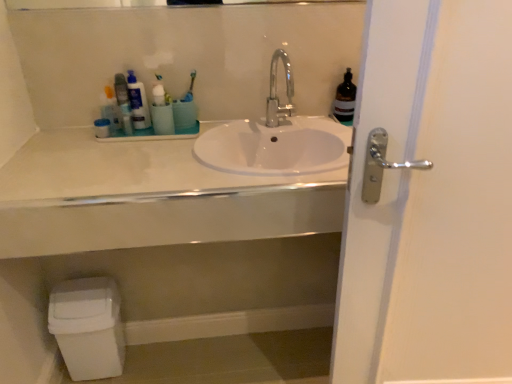
Find the location of `matte plastic container at upper left, placed as the first toiletry when sorted from left to right`. matte plastic container at upper left, placed as the first toiletry when sorted from left to right is located at coordinates tap(110, 111).

The height and width of the screenshot is (384, 512). What do you see at coordinates (102, 128) in the screenshot?
I see `white plastic container at upper left, which is counted as the second toiletry, starting from the left` at bounding box center [102, 128].

You are a GUI agent. You are given a task and a screenshot of the screen. Output one action in this format:
    pyautogui.click(x=<x>, y=<y>)
    Task: Click on the matte plastic container at upper left, placed as the first toiletry when sorted from left to right
    
    Given the screenshot: What is the action you would take?
    pyautogui.click(x=110, y=111)

What are the coordinates of `screen door in front of the white plastic toilet bowl at lower left` in the screenshot? It's located at (430, 199).

Is white glossy door handle at right inside the boundaries of white plastic toilet bowl at lower left, or outside?

white glossy door handle at right is not inside white plastic toilet bowl at lower left, it's outside.

Is point (373, 110) positioned after point (102, 318)?

That is False.

Looking at the image, does white glossy door handle at right seem bigger or smaller compared to white plastic toilet bowl at lower left?

white glossy door handle at right is bigger than white plastic toilet bowl at lower left.

Is polished chrome faucet at center positioned with its back to blue plastic toothbrush at upper center?

No.

Can you confirm if polished chrome faucet at center is bigger than blue plastic toothbrush at upper center?

Indeed, polished chrome faucet at center has a larger size compared to blue plastic toothbrush at upper center.

Can you see polished chrome faucet at center touching blue plastic toothbrush at upper center?

They are not placed beside each other.

Considering the sizes of objects polished chrome faucet at center and blue plastic toothbrush at upper center in the image provided, who is taller, polished chrome faucet at center or blue plastic toothbrush at upper center?

polished chrome faucet at center is taller.

Is point (131, 107) behind point (97, 127)?

Yes, point (131, 107) is behind point (97, 127).

From the image's perspective, would you say translucent plastic bottle at upper left, which is counted as the third toiletry, starting from the left, is shown under white plastic container at upper left, which is counted as the second toiletry, starting from the left?

No, from the image's perspective, translucent plastic bottle at upper left, which is counted as the third toiletry, starting from the left, is not below white plastic container at upper left, which is counted as the second toiletry, starting from the left.

From a real-world perspective, is translucent plastic bottle at upper left, the 1th toiletry from the right, below white plastic container at upper left, which is the 2th toiletry from right to left?

No.

Which object is positioned more to the left, translucent plastic bottle at upper left, the 1th toiletry from the right, or white plastic container at upper left, which is counted as the second toiletry, starting from the left?

From the viewer's perspective, white plastic container at upper left, which is counted as the second toiletry, starting from the left, appears more on the left side.

From a real-world perspective, which object stands above the other?

white plastic container at upper left, which is the 2th toiletry from right to left.

Is white glossy sink at center with white plastic container at upper left, which is counted as the second toiletry, starting from the left?

white glossy sink at center and white plastic container at upper left, which is counted as the second toiletry, starting from the left, are clearly separated.

Looking at this image, could you tell me if white glossy sink at center is facing white plastic container at upper left, which is the 2th toiletry from right to left?

No, white glossy sink at center does not turn towards white plastic container at upper left, which is the 2th toiletry from right to left.

Consider the image. Considering the relative positions of white glossy sink at center and white plastic container at upper left, which is the 2th toiletry from right to left, in the image provided, is white glossy sink at center behind white plastic container at upper left, which is the 2th toiletry from right to left,?

No, it is in front of white plastic container at upper left, which is the 2th toiletry from right to left.

Considering the relative positions of blue plastic toothbrush at upper center and matte plastic container at upper left, placed as the first toiletry when sorted from left to right, in the image provided, is blue plastic toothbrush at upper center to the left or to the right of matte plastic container at upper left, placed as the first toiletry when sorted from left to right,?

Clearly, blue plastic toothbrush at upper center is on the right of matte plastic container at upper left, placed as the first toiletry when sorted from left to right, in the image.

Find the location of `toothbrush to the right of matte plastic container at upper left, placed as the 3th toiletry when sorted from right to left`. toothbrush to the right of matte plastic container at upper left, placed as the 3th toiletry when sorted from right to left is located at coordinates (190, 88).

Do you think blue plastic toothbrush at upper center is within matte plastic container at upper left, placed as the first toiletry when sorted from left to right, or outside of it?

blue plastic toothbrush at upper center is not inside matte plastic container at upper left, placed as the first toiletry when sorted from left to right, it's outside.

In terms of height, does blue plastic toothbrush at upper center look taller or shorter compared to matte plastic container at upper left, placed as the 3th toiletry when sorted from right to left?

blue plastic toothbrush at upper center is shorter than matte plastic container at upper left, placed as the 3th toiletry when sorted from right to left.

How many degrees apart are the facing directions of white glossy door handle at right and matte plastic container at upper left, placed as the 3th toiletry when sorted from right to left?

3.85 degrees.

Looking at the image, does white glossy door handle at right seem bigger or smaller compared to matte plastic container at upper left, placed as the first toiletry when sorted from left to right?

white glossy door handle at right is bigger than matte plastic container at upper left, placed as the first toiletry when sorted from left to right.

Between white glossy door handle at right and matte plastic container at upper left, placed as the first toiletry when sorted from left to right, which one has more height?

white glossy door handle at right.

Based on their positions, is white glossy door handle at right located to the left or right of matte plastic container at upper left, placed as the 3th toiletry when sorted from right to left?

From the image, it's evident that white glossy door handle at right is to the right of matte plastic container at upper left, placed as the 3th toiletry when sorted from right to left.

From the image's perspective, who appears lower, blue plastic toothbrush at upper center or polished chrome faucet at center?

From the image's view, polished chrome faucet at center is below.

From a real-world perspective, is blue plastic toothbrush at upper center on polished chrome faucet at center?

Yes.

From the picture: Is polished chrome faucet at center at the back of blue plastic toothbrush at upper center?

No, blue plastic toothbrush at upper center is not facing away from polished chrome faucet at center.

Between blue plastic toothbrush at upper center and polished chrome faucet at center, which one has smaller width?

blue plastic toothbrush at upper center.

The height and width of the screenshot is (384, 512). In order to click on screen door that is above the white plastic toilet bowl at lower left (from a real-world perspective) in this screenshot , I will do `click(430, 199)`.

The width and height of the screenshot is (512, 384). Identify the location of tap located underneath the blue plastic toothbrush at upper center (from a real-world perspective). (276, 92).

Which object lies nearer to the anchor point white glossy sink at center, white plastic toilet bowl at lower left or polished chrome faucet at center?

Among the two, white plastic toilet bowl at lower left is located nearer to white glossy sink at center.

Looking at the image, which one is located further to matte plastic container at upper left, placed as the first toiletry when sorted from left to right, white plastic container at upper left, which is the 2th toiletry from right to left, or polished chrome faucet at center?

Based on the image, polished chrome faucet at center appears to be further to matte plastic container at upper left, placed as the first toiletry when sorted from left to right.

Looking at the image, which one is located closer to white plastic container at upper left, which is counted as the second toiletry, starting from the left, white plastic toilet bowl at lower left or matte plastic container at upper left, placed as the first toiletry when sorted from left to right?

matte plastic container at upper left, placed as the first toiletry when sorted from left to right, is closer to white plastic container at upper left, which is counted as the second toiletry, starting from the left.

Which object lies nearer to the anchor point blue plastic toothbrush at upper center, white glossy door handle at right or white plastic toilet bowl at lower left?

white plastic toilet bowl at lower left lies closer to blue plastic toothbrush at upper center than the other object.

When comparing their distances from translucent plastic bottle at upper left, which is counted as the third toiletry, starting from the left, does white glossy door handle at right or transparent glass mirror at upper center seem closer?

transparent glass mirror at upper center lies closer to translucent plastic bottle at upper left, which is counted as the third toiletry, starting from the left, than the other object.

Which object lies further to the anchor point white glossy door handle at right, white glossy sink at center or blue plastic toothbrush at upper center?

blue plastic toothbrush at upper center.

From the image, which object appears to be farther from white plastic toilet bowl at lower left, white glossy sink at center or transparent glass mirror at upper center?

The object further to white plastic toilet bowl at lower left is transparent glass mirror at upper center.

Based on their spatial positions, is transparent glass mirror at upper center or matte plastic container at upper left, placed as the 3th toiletry when sorted from right to left, further from white glossy sink at center?

The object further to white glossy sink at center is transparent glass mirror at upper center.

Find the location of `tap between matte plastic container at upper left, placed as the 3th toiletry when sorted from right to left, and white glossy door handle at right from left to right`. tap between matte plastic container at upper left, placed as the 3th toiletry when sorted from right to left, and white glossy door handle at right from left to right is located at coordinates (276, 92).

The height and width of the screenshot is (384, 512). I want to click on mirror between white plastic toilet bowl at lower left and white glossy door handle at right, so click(80, 4).

I want to click on toothbrush that lies between transparent glass mirror at upper center and translucent plastic bottle at upper left, the 1th toiletry from the right, from top to bottom, so click(190, 88).

Where is `toiletry situated between white plastic container at upper left, which is counted as the second toiletry, starting from the left, and white glossy door handle at right from left to right`? toiletry situated between white plastic container at upper left, which is counted as the second toiletry, starting from the left, and white glossy door handle at right from left to right is located at coordinates (138, 102).